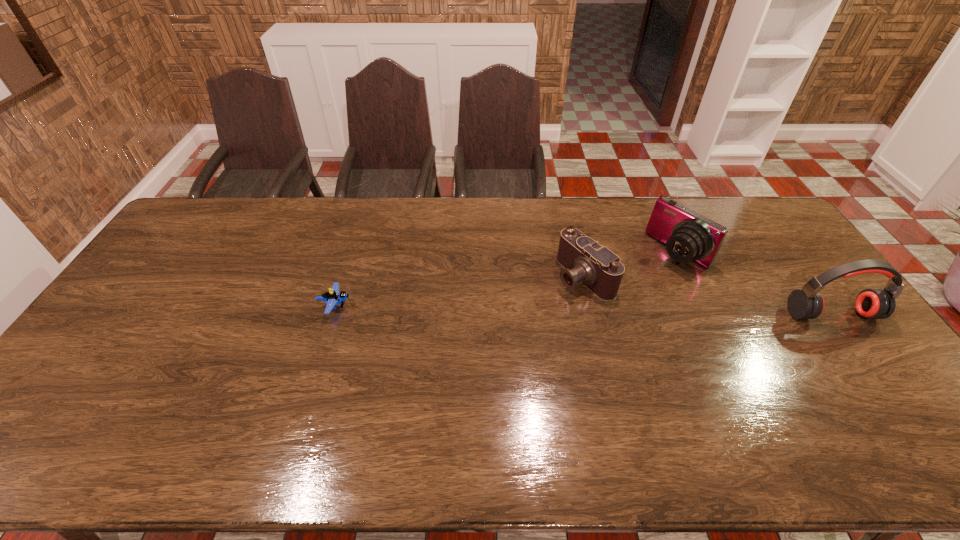
Where is `Lego`? The height and width of the screenshot is (540, 960). Lego is located at coordinates (332, 298).

You are a GUI agent. You are given a task and a screenshot of the screen. Output one action in this format:
    pyautogui.click(x=<x>, y=<y>)
    Task: Click on the shortest object
    The width and height of the screenshot is (960, 540).
    Given the screenshot: What is the action you would take?
    pyautogui.click(x=332, y=298)

Where is `earphone`? The height and width of the screenshot is (540, 960). earphone is located at coordinates point(807,303).

This screenshot has height=540, width=960. What are the coordinates of `the rightmost object` in the screenshot? It's located at (807, 303).

Find the location of a particular element. the second object from right to left is located at coordinates (688, 236).

The height and width of the screenshot is (540, 960). What are the coordinates of `the taller camera` in the screenshot? It's located at (688, 236).

Locate an element on the screen. This screenshot has height=540, width=960. the shorter camera is located at coordinates (584, 260).

The height and width of the screenshot is (540, 960). Identify the location of the left camera. (584, 260).

Locate an element on the screen. free space located on the front-facing side of the shortest object is located at coordinates (402, 306).

In order to click on vacant space located 0.110m on the ear cups of the earphone in this screenshot , I will do `click(863, 357)`.